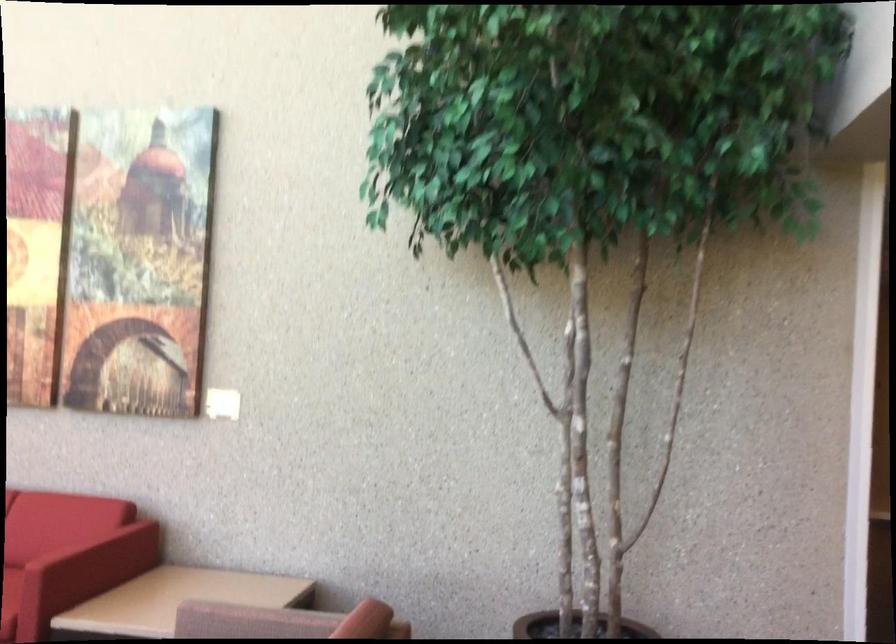
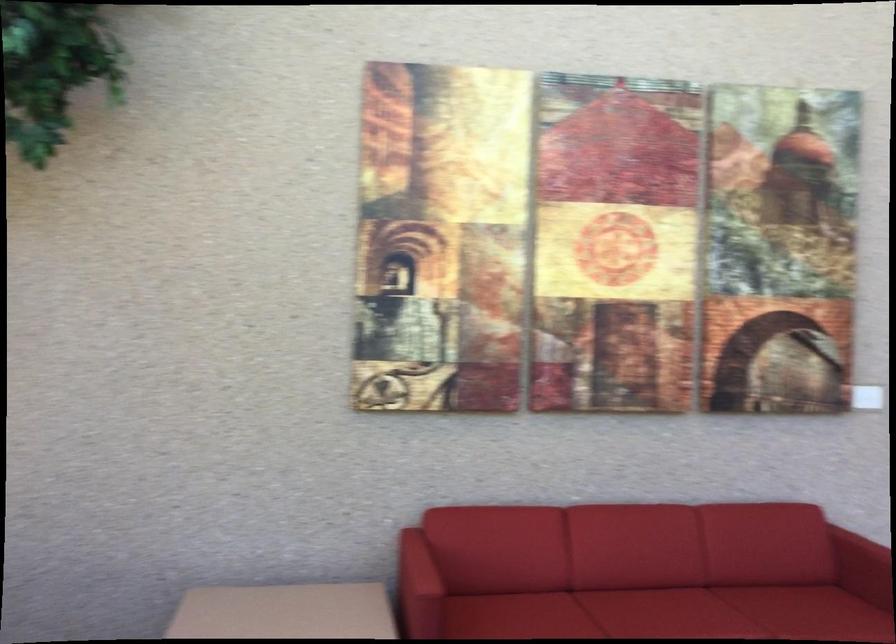
In the second image, find the point that corresponds to the point at 256,404 in the first image.

(867, 397)